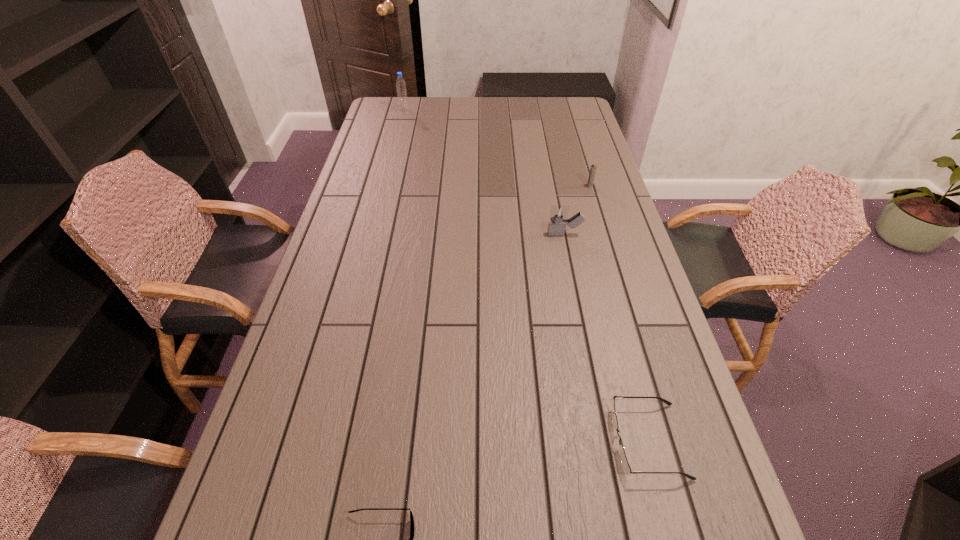
In the image, there is a desktop. Identify the location of free space at the right edge. (605, 296).

This screenshot has height=540, width=960. In the image, there is a desktop. Identify the location of free region at the far right corner. (554, 102).

The image size is (960, 540). In order to click on unoccupied position between the taller igniter and the farthest object in this screenshot , I will do `click(484, 172)`.

Identify the location of free space between the farther igniter and the third nearest object. (577, 210).

You are a GUI agent. You are given a task and a screenshot of the screen. Output one action in this format:
    pyautogui.click(x=<x>, y=<y>)
    Task: Click on the unoccupied position between the farther spectacles and the left igniter
    Image resolution: width=960 pixels, height=540 pixels.
    Given the screenshot: What is the action you would take?
    pyautogui.click(x=607, y=338)

Find the location of a particular element. vacant area that lies between the fourth farthest object and the taller igniter is located at coordinates (607, 338).

The image size is (960, 540). In order to click on free space between the shorter igniter and the farther spectacles in this screenshot , I will do `click(619, 313)`.

What are the coordinates of `empty space that is in between the tallest object and the third nearest object` in the screenshot? It's located at pyautogui.click(x=484, y=172).

Image resolution: width=960 pixels, height=540 pixels. In order to click on free space between the tallest object and the second nearest object in this screenshot , I will do `click(526, 275)`.

This screenshot has width=960, height=540. Identify the location of free space between the farther igniter and the water bottle. (497, 148).